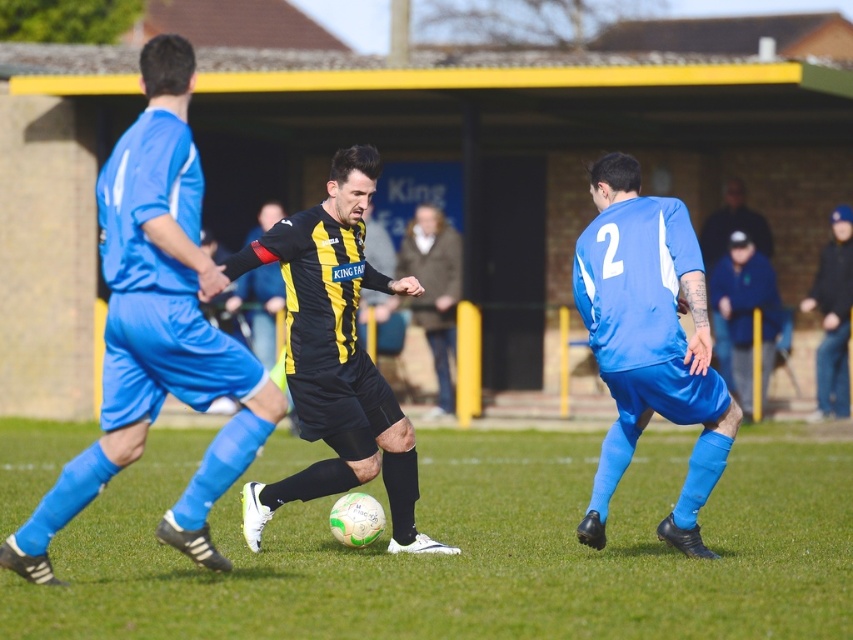
You are a soccer player trying to pass the ball to your teammate. You notice two items on the field that might interfere with your pass. The items are the blue fabric jacket at right and the dark blue jeans at right. If your pass travels in a straight line from the ball to the goal, will it pass between these two items?

The blue fabric jacket at right and dark blue jeans at right are 35.44 inches apart from each other. Since the distance between them is sufficient, the pass could potentially go through the gap between them if aimed correctly.

You are a soccer referee observing the match. You notice the yellow and black jersey at center and the dark blue jeans at right. Which one is higher in the image?

The yellow and black jersey at center is above dark blue jeans at right, so it is higher in the image.

You are a soccer coach analyzing the game from the sidelines. You notice two points marked on the field at coordinates point [764,269] and point [817,396]. Which point is closer to the camera you are using to film the match?

Point [817,396] is closer to the camera because the description states that point [764,269] is further away from the camera than point [817,396].